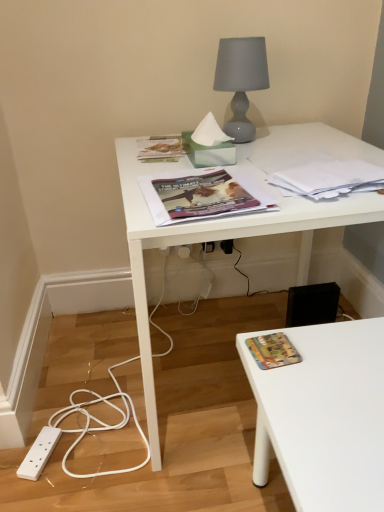
I want to click on free point in front of white plastic power plugs and sockets at lower left, so click(41, 489).